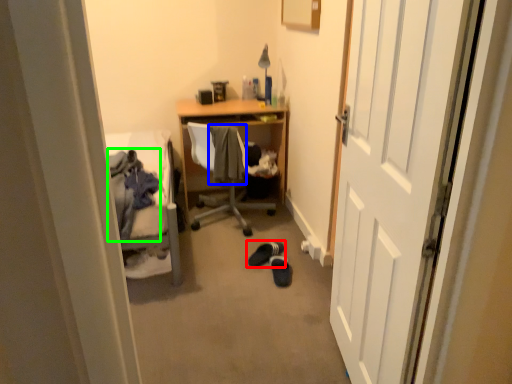
Question: Estimate the real-world distances between objects in this image. Which object is closer to footwear (highlighted by a red box), clothing (highlighted by a blue box) or clothing (highlighted by a green box)?

Choices:
 (A) clothing
 (B) clothing

Answer: (A)